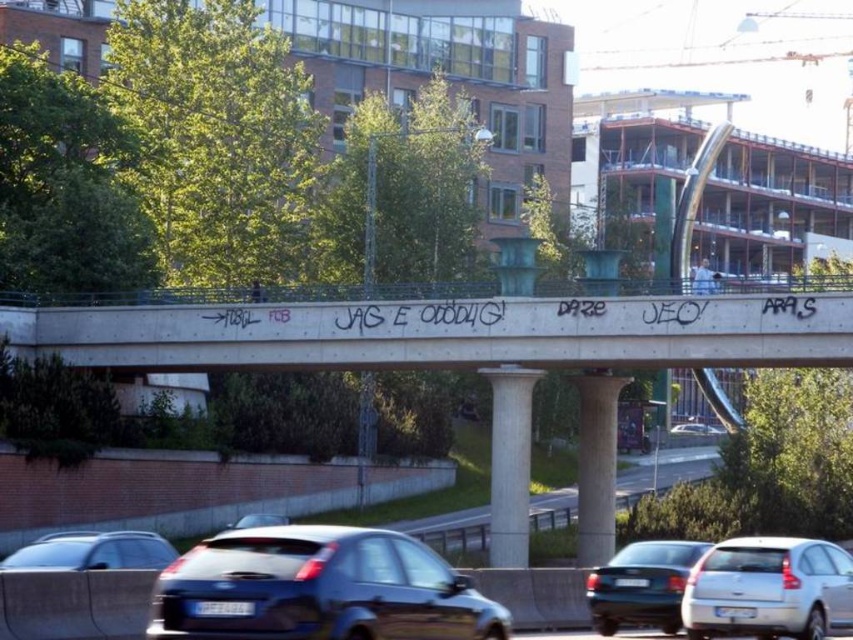
Question: Does silver metallic hatchback at lower right have a greater width compared to metallic silver car at lower left?

Choices:
 (A) no
 (B) yes

Answer: (A)

Question: Can you confirm if metallic blue hatchback at lower center is positioned above silver metallic hatchback at lower right?

Choices:
 (A) yes
 (B) no

Answer: (B)

Question: Considering the real-world distances, which object is closest to the concrete graffiti at center?

Choices:
 (A) matte black car at lower center
 (B) shiny blue sedan at center
 (C) green asphalt highway at center
 (D) metallic silver car at lower left

Answer: (B)

Question: Estimate the real-world distances between objects in this image. Which object is closer to the green asphalt highway at center?

Choices:
 (A) shiny blue sedan at center
 (B) matte black car at lower center
 (C) metallic silver car at lower left
 (D) metallic blue hatchback at lower center

Answer: (A)

Question: Can you confirm if concrete graffiti at center is wider than metallic silver car at lower left?

Choices:
 (A) yes
 (B) no

Answer: (A)

Question: Which point is closer to the camera taking this photo?

Choices:
 (A) (279, 515)
 (B) (796, 358)

Answer: (B)